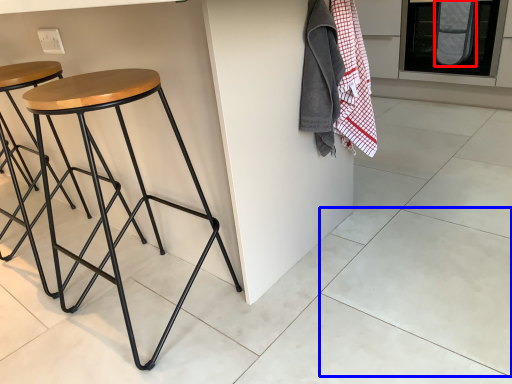
Question: Which object is further to the camera taking this photo, blanket (highlighted by a red box) or tile (highlighted by a blue box)?

Choices:
 (A) blanket
 (B) tile

Answer: (A)